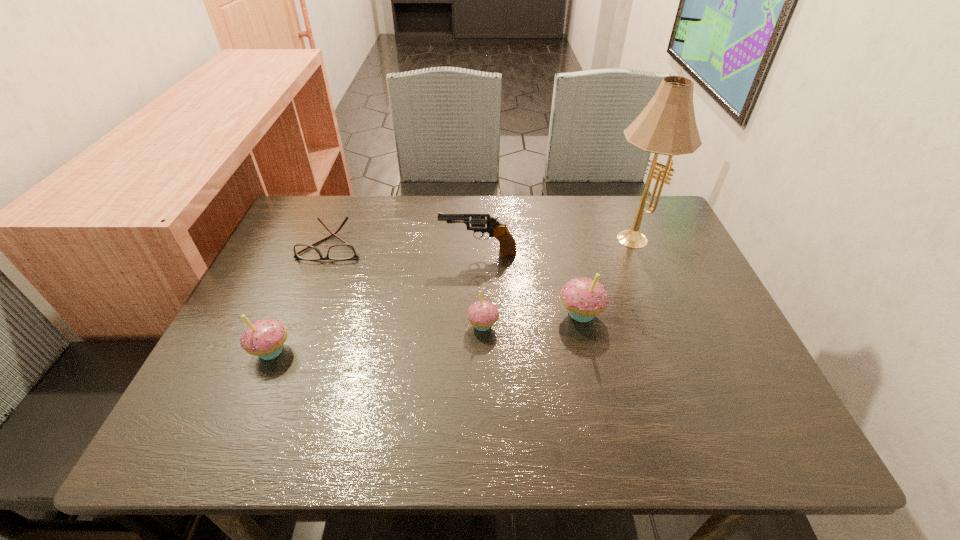
This screenshot has width=960, height=540. In order to click on vacant spot for a new cupcake to ensure equal spacing in this screenshot , I will do `click(380, 338)`.